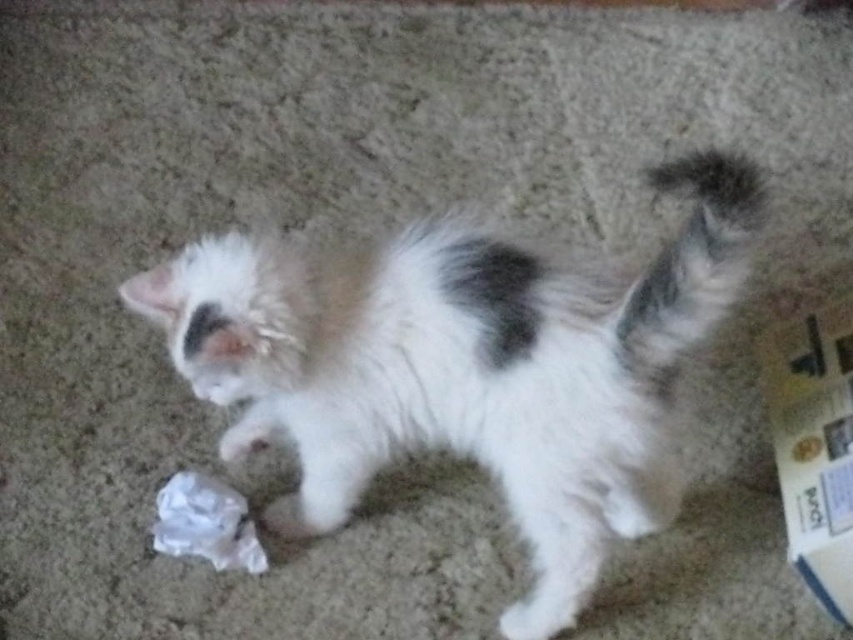
Does point (676, 356) lie in front of point (247, 502)?

That is True.

Describe the element at coordinates (692, 260) in the screenshot. I see `fluffy white tail at upper right` at that location.

Is point (712, 284) closer to viewer compared to point (183, 484)?

Yes, it is in front of point (183, 484).

The width and height of the screenshot is (853, 640). I want to click on fluffy white tail at upper right, so click(x=692, y=260).

Between point (494, 384) and point (633, 339), which one is positioned behind?

Point (494, 384)

This screenshot has height=640, width=853. I want to click on white fluffy cat at center, so click(466, 369).

Which is behind, point (730, 259) or point (262, 556)?

The point (262, 556) is behind.

Where is `white fluffy cat at center`? white fluffy cat at center is located at coordinates (466, 369).